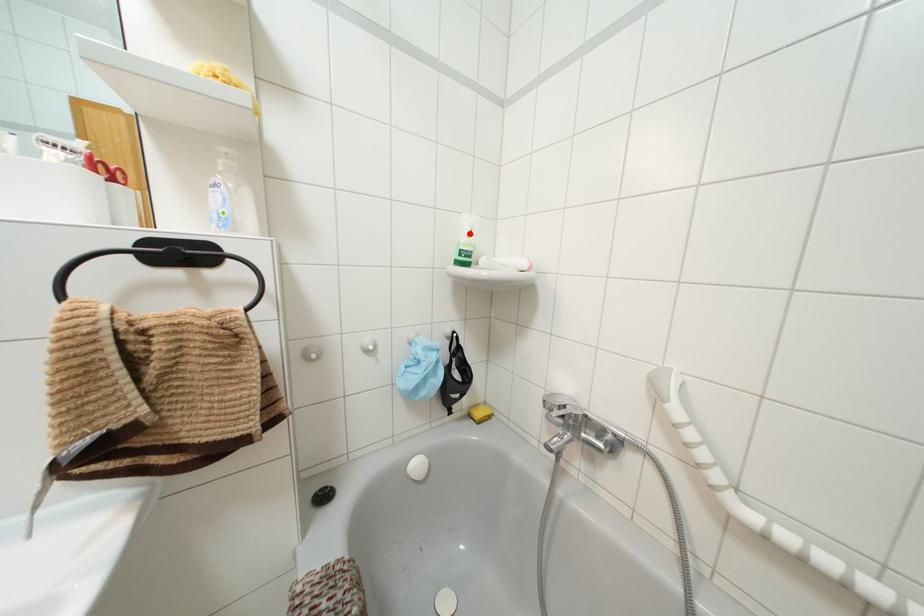
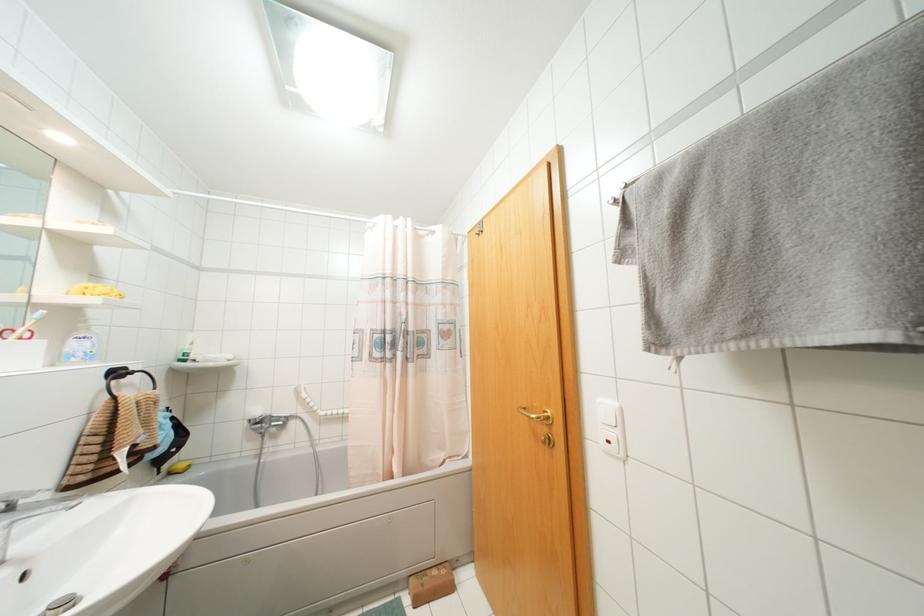
In the second image, find the point that corresponds to the highlighted location in the first image.

(190, 342)